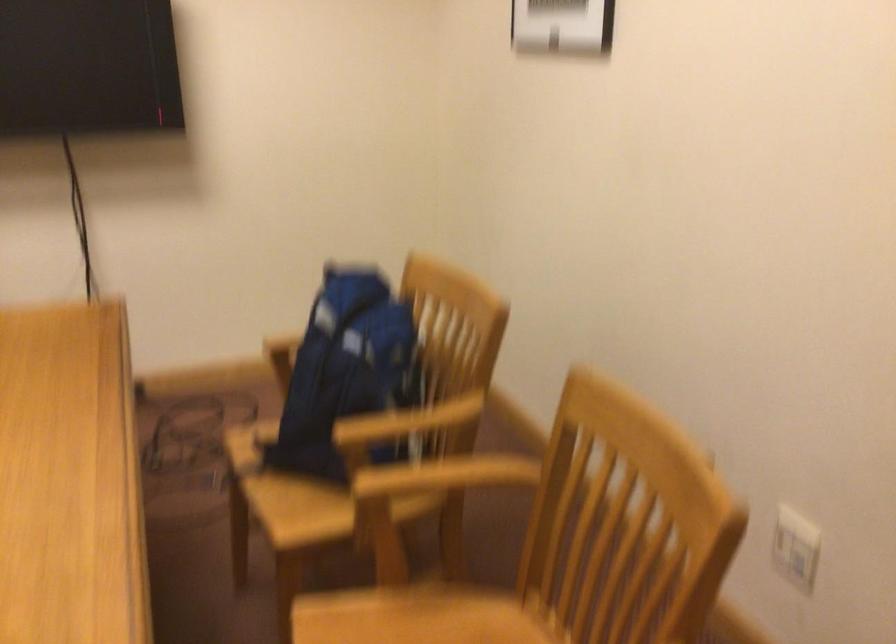
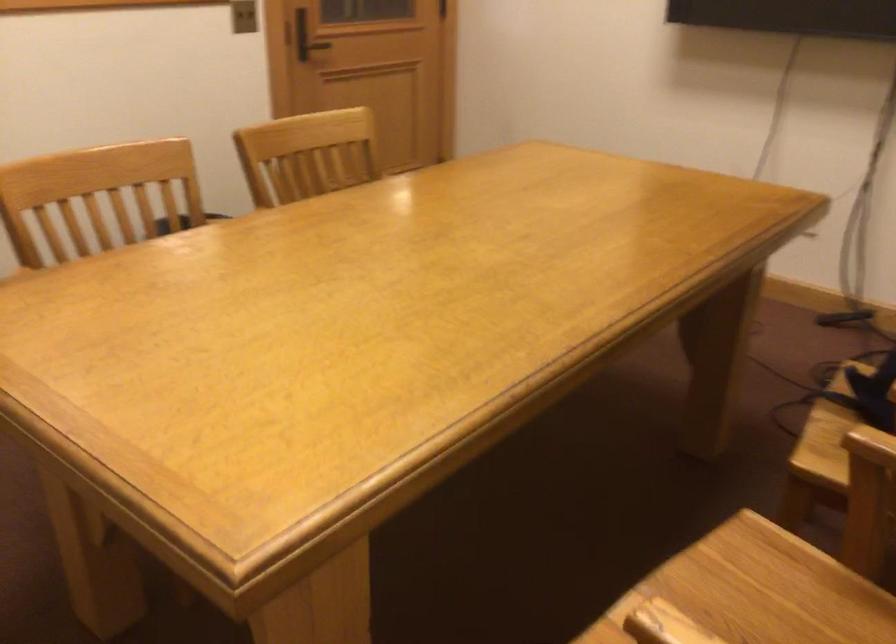
Question: The camera is either moving clockwise (left) or counter-clockwise (right) around the object. The first image is from the beginning of the video and the second image is from the end. Is the camera moving left or right when shooting the video?

Choices:
 (A) Left
 (B) Right

Answer: (B)